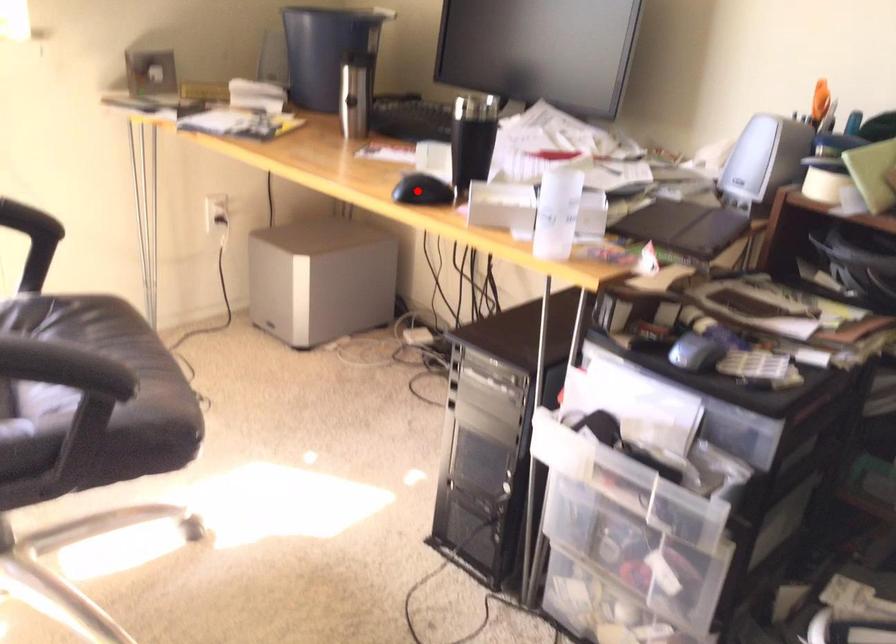
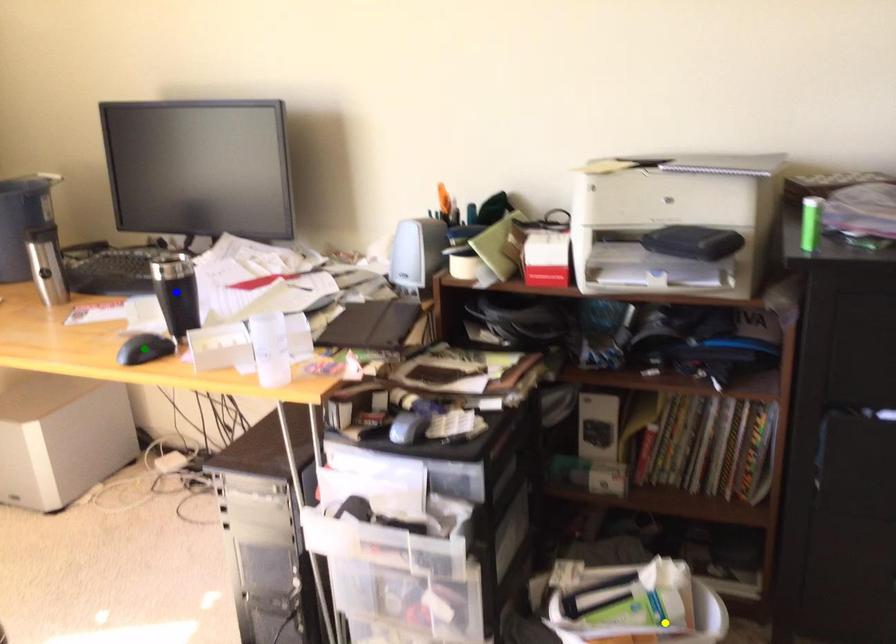
Question: I am providing you with two images of the same scene from different viewpoints. A red point is marked on the first image. You are given multiple points on the second image. Which point in image 2 is actually the same real-world point as the red point in image 1?

Choices:
 (A) green point
 (B) yellow point
 (C) blue point

Answer: (A)